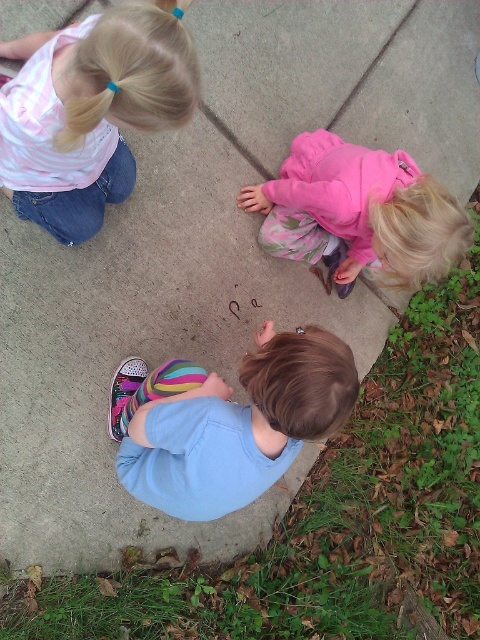
Question: Can you confirm if striped cotton shirt at upper left is positioned below blue cotton shirt at lower center?

Choices:
 (A) no
 (B) yes

Answer: (A)

Question: Which of the following is the farthest from the observer?

Choices:
 (A) striped cotton shirt at upper left
 (B) pink fleece jacket at lower right
 (C) blue cotton shirt at lower center

Answer: (B)

Question: Is striped cotton shirt at upper left wider than pink fleece jacket at lower right?

Choices:
 (A) yes
 (B) no

Answer: (A)

Question: Can you confirm if striped cotton shirt at upper left is positioned above pink fleece jacket at lower right?

Choices:
 (A) no
 (B) yes

Answer: (B)

Question: Which point is farther from the camera taking this photo?

Choices:
 (A) (298, 172)
 (B) (153, 433)

Answer: (A)

Question: Estimate the real-world distances between objects in this image. Which object is farther from the striped cotton shirt at upper left?

Choices:
 (A) blue cotton shirt at lower center
 (B) pink fleece jacket at lower right

Answer: (A)